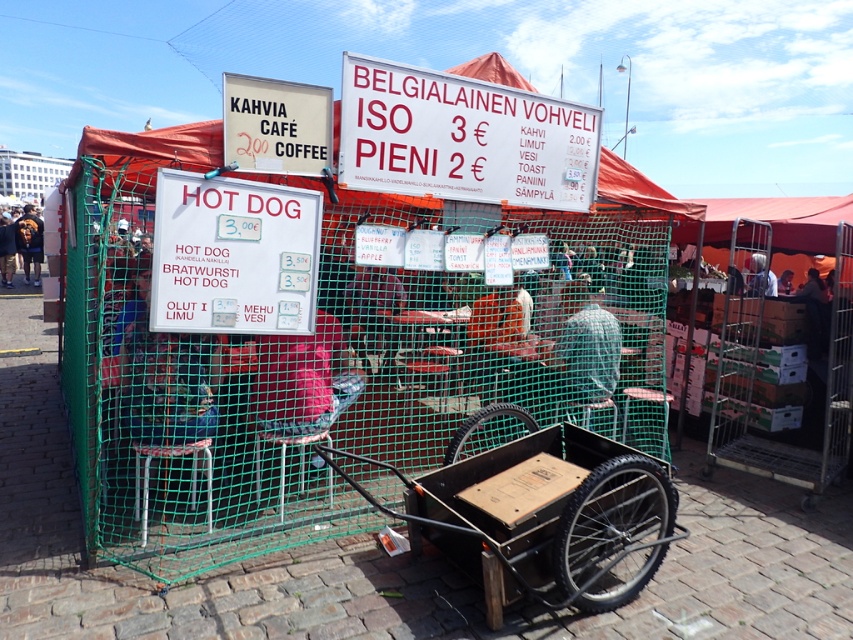
Question: Can you confirm if wooden cart at lower center is smaller than white paper sign at center?

Choices:
 (A) no
 (B) yes

Answer: (A)

Question: Which object appears farthest from the camera in this image?

Choices:
 (A) wooden cart at lower center
 (B) white paper sign at center
 (C) white plastic sign at upper center

Answer: (C)

Question: Which point is closer to the camera?

Choices:
 (A) white plastic sign at upper center
 (B) wooden cart at lower center
 (C) white paper sign at center

Answer: (B)

Question: Does wooden cart at lower center lie behind white paper sign at center?

Choices:
 (A) no
 (B) yes

Answer: (A)

Question: Which point is farther to the camera?

Choices:
 (A) white paper sign at center
 (B) white plastic sign at upper center
 (C) wooden cart at lower center

Answer: (B)

Question: Is wooden cart at lower center below white plastic sign at upper center?

Choices:
 (A) no
 (B) yes

Answer: (B)